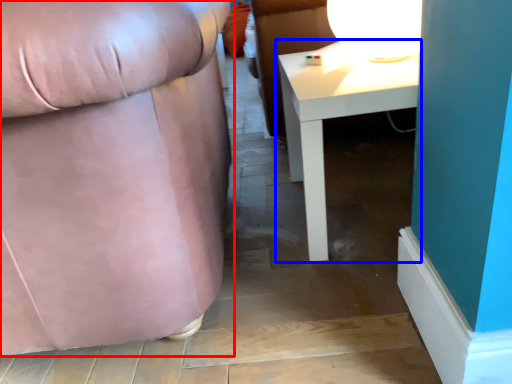
Question: Which point is further to the camera, chair (highlighted by a red box) or table (highlighted by a blue box)?

Choices:
 (A) chair
 (B) table

Answer: (B)